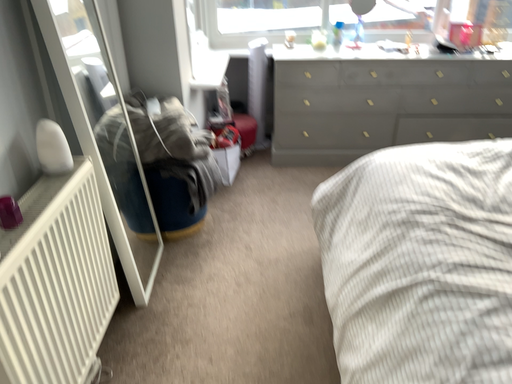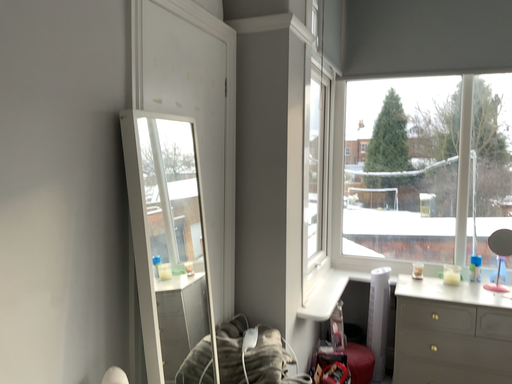
Question: How did the camera likely rotate when shooting the video?

Choices:
 (A) rotated downward
 (B) rotated upward

Answer: (B)